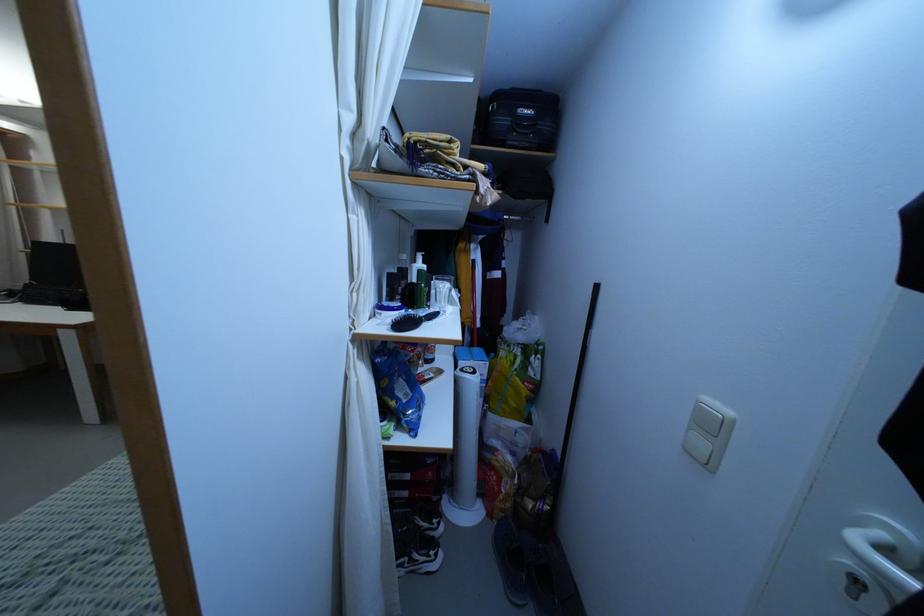
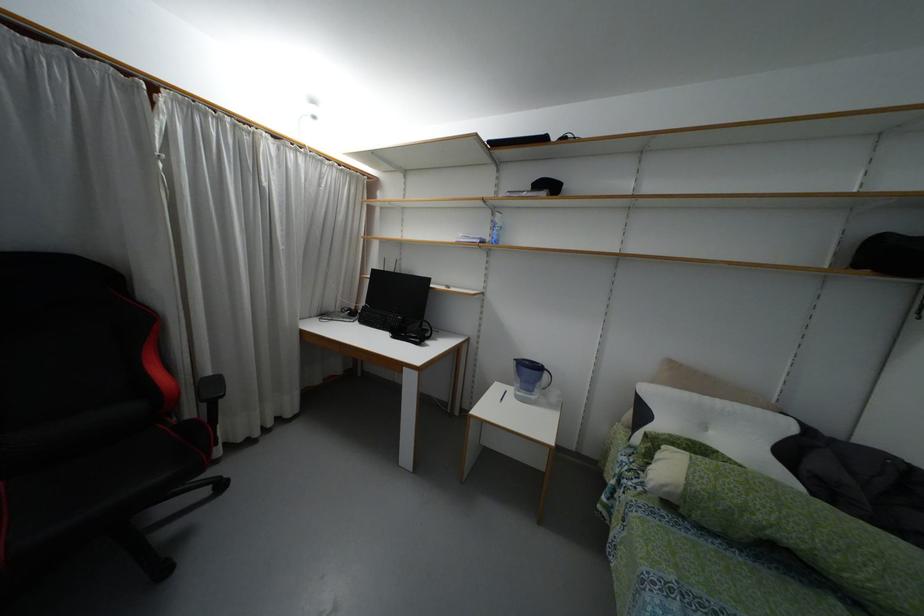
Question: In a continuous first-person perspective shot, in which direction is the camera moving?

Choices:
 (A) Left
 (B) Right
 (C) Forward
 (D) Backward

Answer: (A)